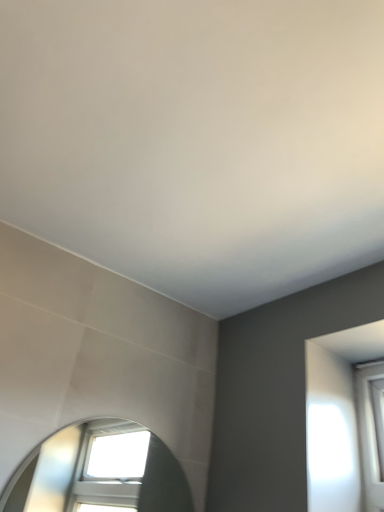
Describe the element at coordinates (99, 472) in the screenshot. I see `polished silver mirror at lower left` at that location.

Find the location of a particular element. This screenshot has height=512, width=384. polished silver mirror at lower left is located at coordinates (99, 472).

The image size is (384, 512). Find the location of `polished silver mirror at lower left`. polished silver mirror at lower left is located at coordinates (99, 472).